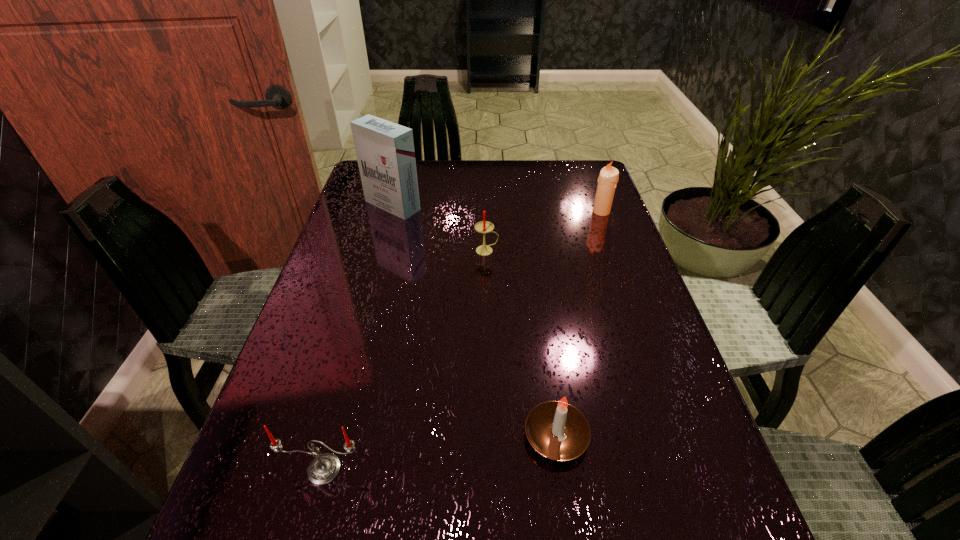
Locate an element on the screen. The height and width of the screenshot is (540, 960). empty space that is in between the cigarette case and the rightmost object is located at coordinates (497, 208).

Identify the location of empty space that is in between the leftmost candle and the fourth object from left to right. (441, 453).

Locate an element on the screen. Image resolution: width=960 pixels, height=540 pixels. free spot between the third candle from left to right and the third nearest candle is located at coordinates (521, 343).

Find the location of a particular element. The height and width of the screenshot is (540, 960). empty space between the second object from right to left and the third nearest candle is located at coordinates (521, 343).

Find the location of a particular element. The width and height of the screenshot is (960, 540). vacant space in between the rightmost object and the third object from right to left is located at coordinates (544, 231).

Find the location of a particular element. The image size is (960, 540). free spot between the tallest object and the second candle from right to left is located at coordinates (474, 321).

I want to click on unoccupied area between the leftmost candle and the third object from right to left, so [405, 360].

Image resolution: width=960 pixels, height=540 pixels. Identify the location of free space between the leftmost candle and the third candle from right to left. (405, 360).

The image size is (960, 540). Identify the location of vacant point located between the second object from right to left and the second tallest object. click(579, 323).

Find the location of `vacant area that lies between the tallest object and the second object from right to left`. vacant area that lies between the tallest object and the second object from right to left is located at coordinates (474, 321).